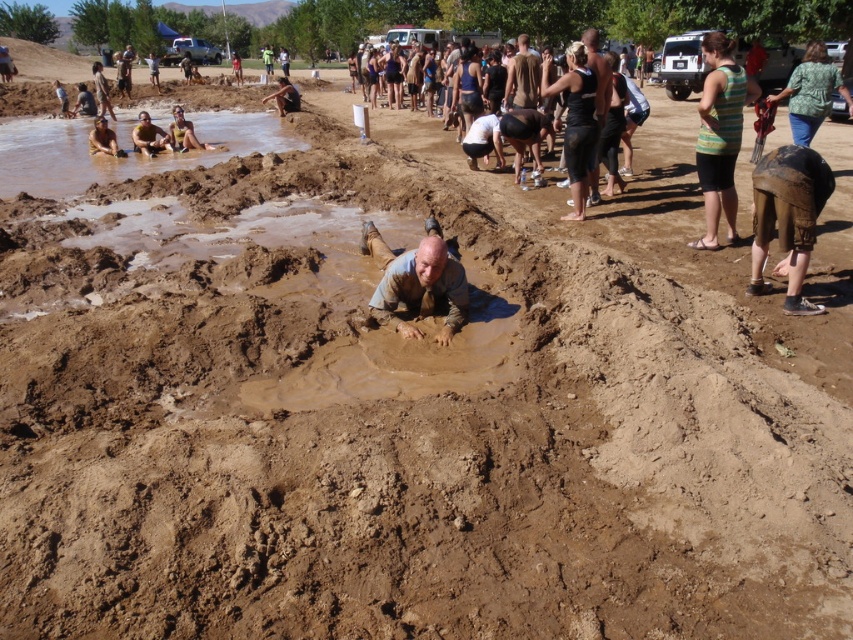
Question: Does tan skin person at upper left appear on the right side of light brown skin at center?

Choices:
 (A) no
 (B) yes

Answer: (B)

Question: Which object is closer to the camera taking this photo?

Choices:
 (A) black cotton tank top at upper center
 (B) matte black shorts at upper left

Answer: (A)

Question: Estimate the real-world distances between objects in this image. Which object is closer to the dark brown skin at upper center?

Choices:
 (A) green striped tank top at right
 (B) tan skin person at upper left
 (C) brown leather shorts at lower left

Answer: (A)

Question: Which is nearer to the light brown skin at center?

Choices:
 (A) brown muddy water at upper left
 (B) green striped tank top at right

Answer: (A)

Question: Is dark brown skin at upper center closer to the viewer compared to light brown mud at center?

Choices:
 (A) yes
 (B) no

Answer: (B)

Question: Can you confirm if black cotton tank top at upper center is positioned above brown leather shorts at lower left?

Choices:
 (A) yes
 (B) no

Answer: (A)